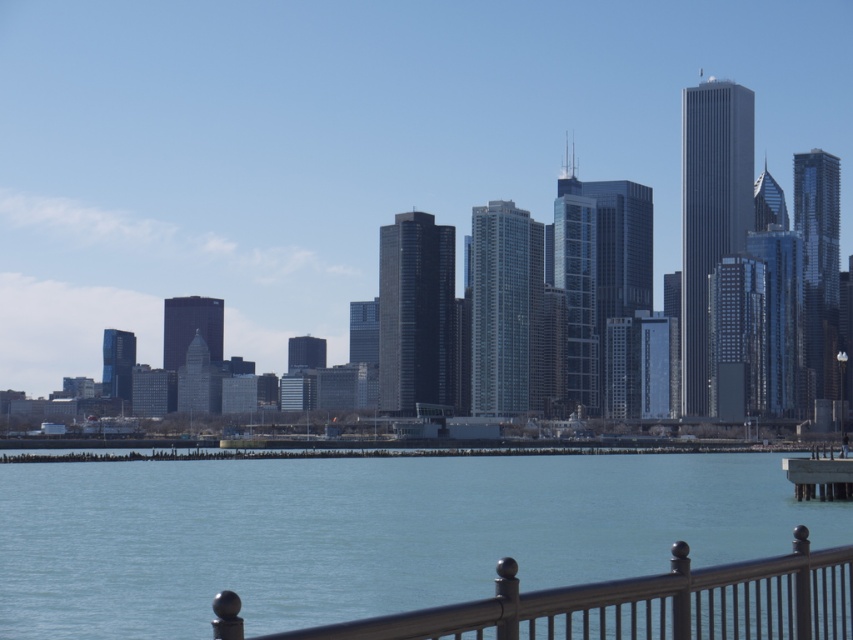
Can you confirm if clear blue water at lower center is positioned above metallic gray railing at lower center?

Actually, clear blue water at lower center is below metallic gray railing at lower center.

Is point (596, 467) less distant than point (780, 577)?

No, (596, 467) is further to viewer.

The width and height of the screenshot is (853, 640). In order to click on clear blue water at lower center in this screenshot , I will do (x=363, y=532).

Does point (613, 609) lie in front of point (848, 483)?

Yes, it is.

Which of these two, metallic gray railing at lower center or gray concrete dock at lower right, stands shorter?

metallic gray railing at lower center

Does point (677, 545) come behind point (793, 477)?

No, it is in front of (793, 477).

Locate an element on the screen. The height and width of the screenshot is (640, 853). metallic gray railing at lower center is located at coordinates (643, 604).

In the scene shown: Measure the distance between clear blue water at lower center and gray concrete dock at lower right.

A distance of 110.18 meters exists between clear blue water at lower center and gray concrete dock at lower right.

Which of these two, clear blue water at lower center or gray concrete dock at lower right, stands shorter?

gray concrete dock at lower right is shorter.

Is point (55, 620) farther from viewer compared to point (785, 468)?

No, (55, 620) is closer to viewer.

Where is `clear blue water at lower center`? This screenshot has width=853, height=640. clear blue water at lower center is located at coordinates (363, 532).